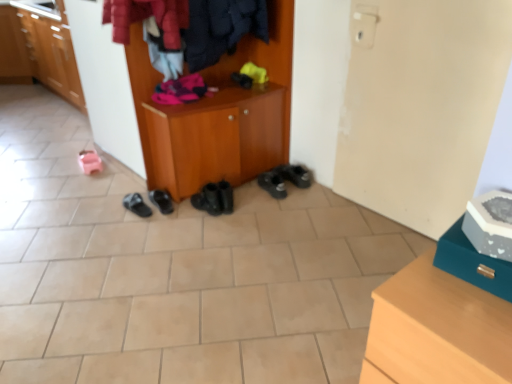
Locate an element on the screen. empty space that is in between pink rubber sandals at lower left, marked as the 6th footwear in a right-to-left arrangement, and black rubber shoes at center, the 3th footwear positioned from the left is located at coordinates (119, 183).